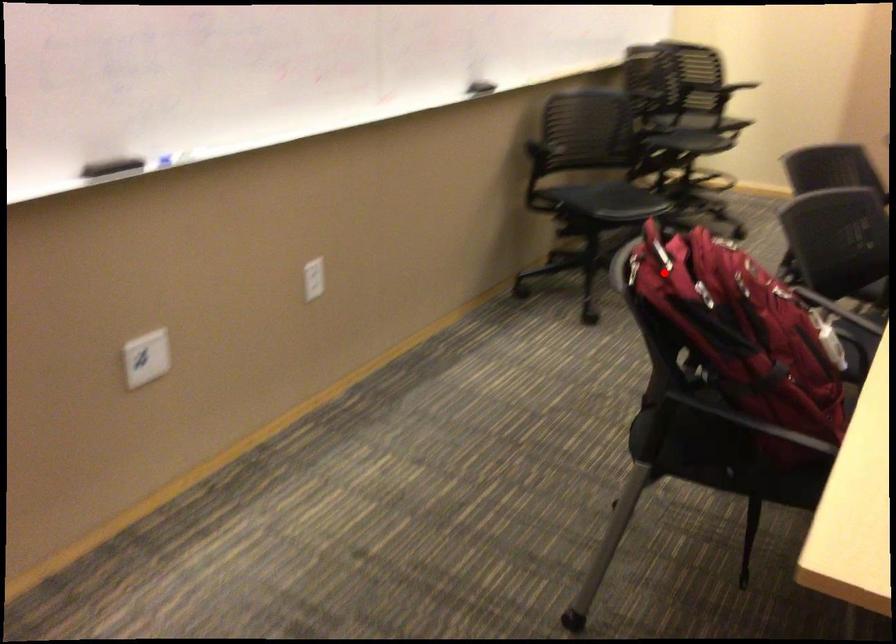
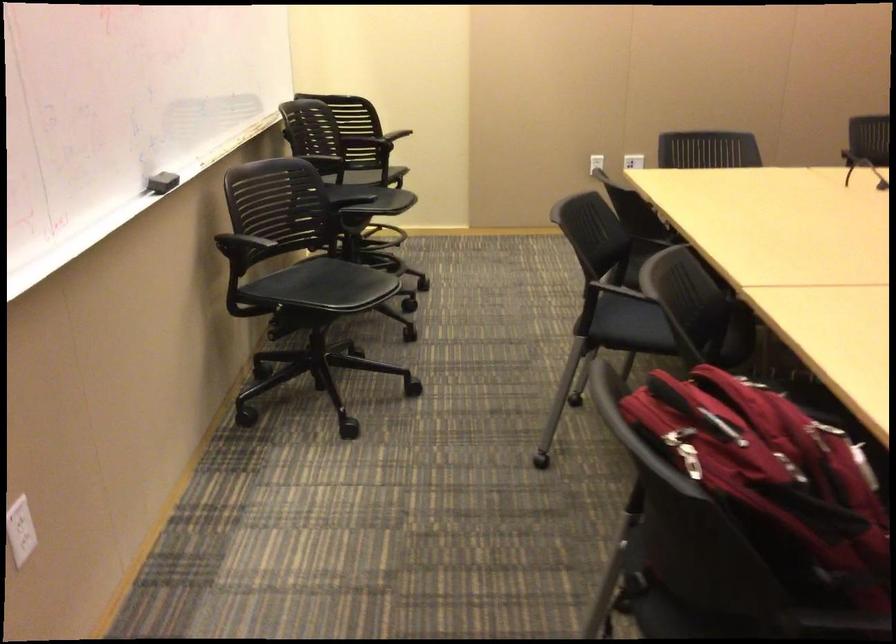
Question: I am providing you with two images of the same scene from different viewpoints. A red point is shown in image1. For the corresponding object point in image2, is it positioned nearer or farther from the camera?

Choices:
 (A) Nearer
 (B) Farther

Answer: (A)